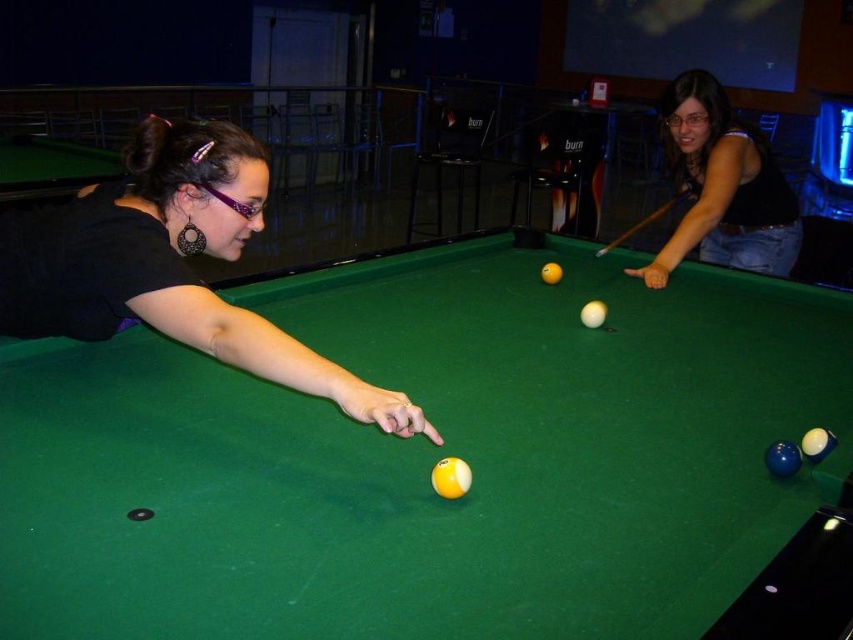
From the picture: You are standing at the edge of the green felt billiard table at center and want to walk to the matte black tank top at upper right. Which direction should you move?

The green felt billiard table at center is positioned on the left side of matte black tank top at upper right, so you should move to the right to reach the matte black tank top at upper right.

You are a pool player standing at the edge of the green felt billiard table at center. You want to hand a cue stick to the person wearing the matte black shirt at left. Can you reach them without moving from your current position?

The distance between the green felt billiard table at center and the matte black shirt at left is 19.54 inches. Since this distance is relatively short, you can likely reach the person wearing the matte black shirt at left without needing to move from your current position at the edge of the table.